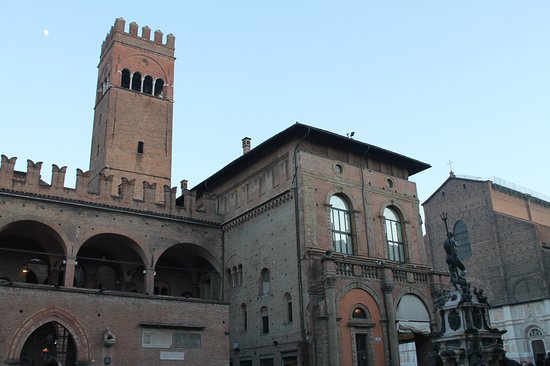
The image size is (550, 366). I want to click on pedestal for statue, so click(x=467, y=332).